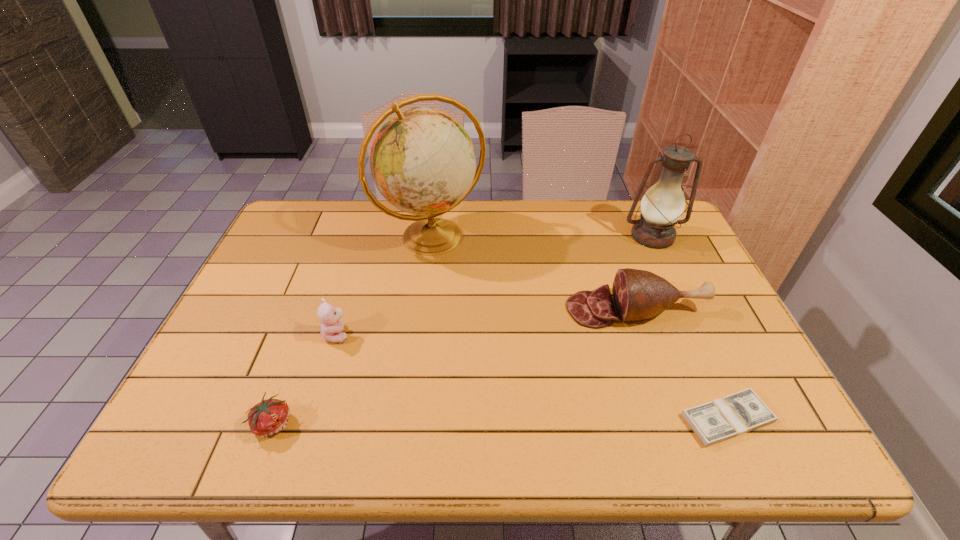
You are a GUI agent. You are given a task and a screenshot of the screen. Output one action in this format:
    pyautogui.click(x=<x>, y=<y>)
    Task: Click on the tallest object
    
    Given the screenshot: What is the action you would take?
    pyautogui.click(x=422, y=160)

Locate an element on the screen. globe is located at coordinates (422, 160).

Where is `the fifth shortest object`? This screenshot has height=540, width=960. the fifth shortest object is located at coordinates (663, 204).

I want to click on ham, so click(638, 294).

The height and width of the screenshot is (540, 960). Identify the location of teddy bear. [332, 325].

In order to click on the leftmost object in this screenshot , I will do `click(267, 418)`.

Find the location of `the second shortest object`. the second shortest object is located at coordinates (267, 418).

Locate an element on the screen. This screenshot has height=540, width=960. dollar is located at coordinates (736, 414).

The height and width of the screenshot is (540, 960). I want to click on vacant space situated on the left of the fourth object from right to left, so (x=328, y=237).

Find the location of a particular element. The height and width of the screenshot is (540, 960). free space located 0.390m on the left of the oil lamp is located at coordinates (501, 237).